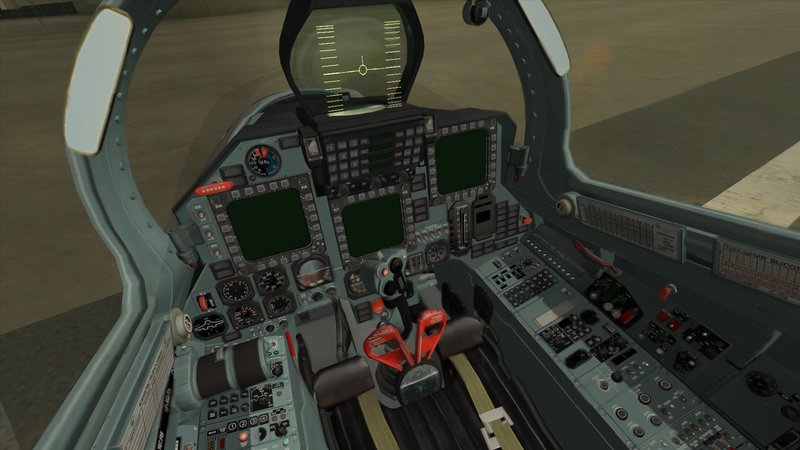
Locate an element on the screen. left window is located at coordinates (33, 242).